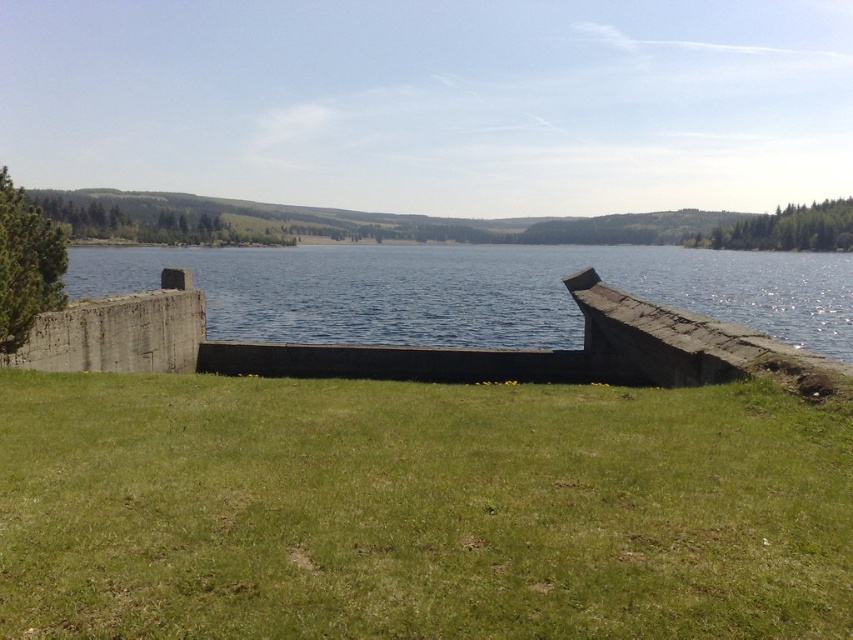
Question: Does green grassy at center come in front of blue concrete water at center?

Choices:
 (A) yes
 (B) no

Answer: (A)

Question: Does green grassy at center come in front of gray concrete wall at left?

Choices:
 (A) no
 (B) yes

Answer: (B)

Question: Does blue concrete water at center appear on the right side of gray concrete wall at left?

Choices:
 (A) yes
 (B) no

Answer: (A)

Question: Which is farther from the blue concrete water at center?

Choices:
 (A) green grassy at center
 (B) gray concrete wall at left

Answer: (A)

Question: Estimate the real-world distances between objects in this image. Which object is farther from the blue concrete water at center?

Choices:
 (A) gray concrete wall at left
 (B) green grassy at center

Answer: (B)

Question: Which is farther from the gray concrete wall at left?

Choices:
 (A) green grassy at center
 (B) blue concrete water at center

Answer: (B)